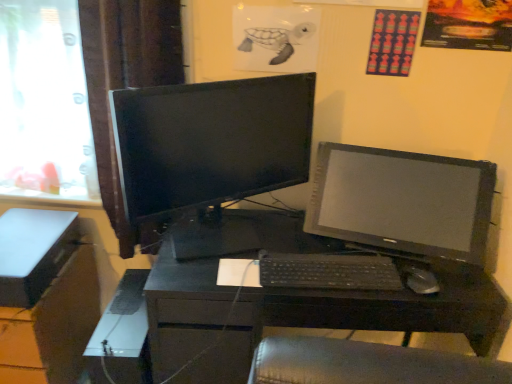
Question: Is black glossy monitor at center, which is the 2th computer monitor in right-to-left order, inside the boundaries of white plastic computer tower at lower left, or outside?

Choices:
 (A) outside
 (B) inside

Answer: (A)

Question: In the image, is black glossy monitor at center, which is the 2th computer monitor in right-to-left order, on the left side or the right side of white plastic computer tower at lower left?

Choices:
 (A) right
 (B) left

Answer: (A)

Question: Based on their relative distances, which object is farther from the white plastic computer tower at lower left?

Choices:
 (A) black glossy monitor at center, which is counted as the 1th computer monitor, starting from the left
 (B) black plastic mouse at center
 (C) brown fabric curtain at left
 (D) satin black monitor at right, positioned as the first computer monitor in right-to-left order
 (E) black plastic keyboard at center

Answer: (B)

Question: Which of these objects is positioned farthest from the white plastic computer tower at lower left?

Choices:
 (A) matte black file cabinet at lower left
 (B) black glossy monitor at center, which is the 2th computer monitor in right-to-left order
 (C) transparent glass window at left
 (D) satin black monitor at right, positioned as the first computer monitor in right-to-left order
 (E) black plastic mouse at center

Answer: (E)